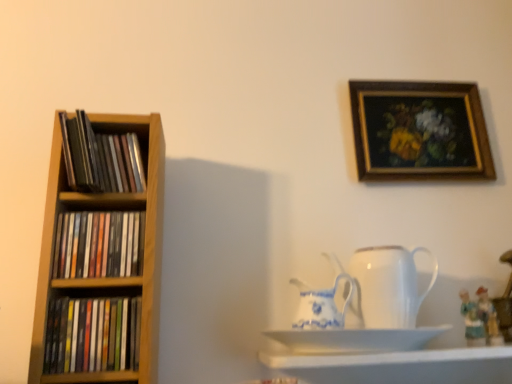
Question: Should I look upward or downward to see white glossy shelf at lower center?

Choices:
 (A) up
 (B) down

Answer: (B)

Question: Can you see white ceramic saucer at lower center touching matte black books at left, which ranks as the first book in bottom-to-top order?

Choices:
 (A) yes
 (B) no

Answer: (B)

Question: Can you confirm if white ceramic saucer at lower center is bigger than matte black books at left, which appears as the third book when viewed from the top?

Choices:
 (A) no
 (B) yes

Answer: (B)

Question: Does white ceramic saucer at lower center appear on the left side of matte black books at left, which appears as the third book when viewed from the top?

Choices:
 (A) no
 (B) yes

Answer: (A)

Question: Is white ceramic saucer at lower center further to camera compared to matte black books at left, which ranks as the first book in bottom-to-top order?

Choices:
 (A) no
 (B) yes

Answer: (A)

Question: From a real-world perspective, is white ceramic saucer at lower center physically above matte black books at left, which appears as the third book when viewed from the top?

Choices:
 (A) yes
 (B) no

Answer: (B)

Question: From the image's perspective, is white ceramic saucer at lower center over matte black books at left, which appears as the third book when viewed from the top?

Choices:
 (A) no
 (B) yes

Answer: (A)

Question: Does white porcelain jug at center, the 2th jug in the right-to-left sequence, lie in front of white ceramic saucer at lower center?

Choices:
 (A) no
 (B) yes

Answer: (A)

Question: From a real-world perspective, is white porcelain jug at center, the first jug in the left-to-right sequence, positioned under white ceramic saucer at lower center based on gravity?

Choices:
 (A) yes
 (B) no

Answer: (B)

Question: Is white porcelain jug at center, the first jug in the left-to-right sequence, wider than white ceramic saucer at lower center?

Choices:
 (A) yes
 (B) no

Answer: (B)

Question: Is white porcelain jug at center, the first jug in the left-to-right sequence, positioned beyond the bounds of white ceramic saucer at lower center?

Choices:
 (A) no
 (B) yes

Answer: (B)

Question: From a real-world perspective, is white porcelain jug at center, the 2th jug in the right-to-left sequence, over white ceramic saucer at lower center?

Choices:
 (A) yes
 (B) no

Answer: (A)

Question: Is white porcelain jug at center, the 2th jug in the right-to-left sequence, aimed at white ceramic saucer at lower center?

Choices:
 (A) yes
 (B) no

Answer: (B)

Question: From the image's perspective, would you say matte ceramic figurine at lower right, which is the first toy in left-to-right order, is shown under white porcelain jug at center, positioned as the second jug in left-to-right order?

Choices:
 (A) no
 (B) yes

Answer: (B)